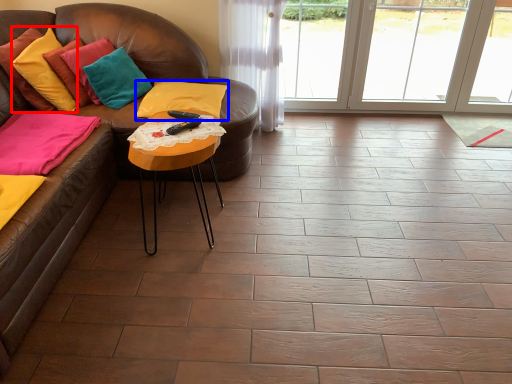
Question: Which object is closer to the camera taking this photo, pillow (highlighted by a red box) or pillow (highlighted by a blue box)?

Choices:
 (A) pillow
 (B) pillow

Answer: (A)